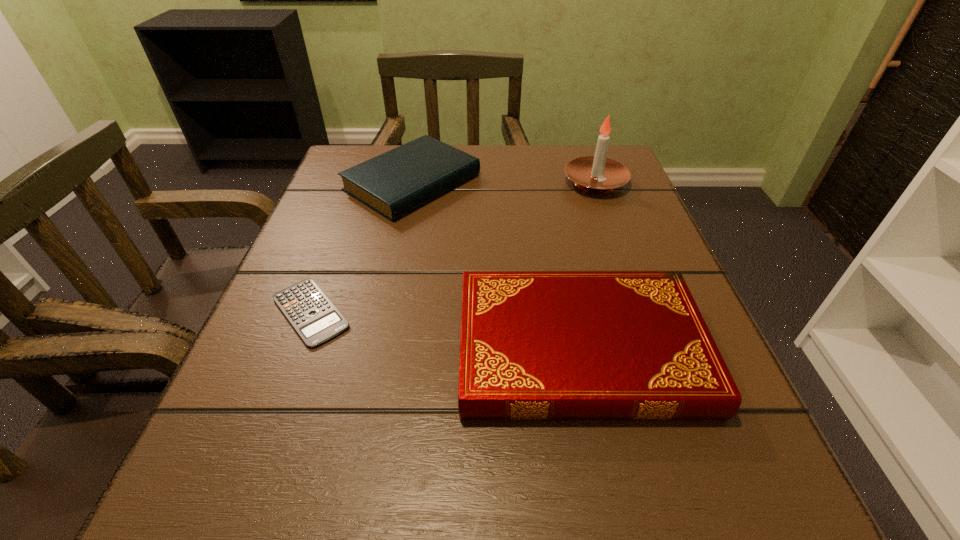
Where is `free space at the left edge of the desktop`? This screenshot has width=960, height=540. free space at the left edge of the desktop is located at coordinates (350, 204).

The height and width of the screenshot is (540, 960). What are the coordinates of `free space at the near left corner of the desktop` in the screenshot? It's located at (204, 513).

In order to click on vacant area that lies between the nearer book and the candle in this screenshot , I will do click(x=588, y=266).

I want to click on unoccupied position between the nearer book and the farther book, so click(x=496, y=266).

At what (x,y) coordinates should I click in order to perform the action: click on free point between the farther book and the candle. Please return your answer as a coordinate pair (x, y). The width and height of the screenshot is (960, 540). Looking at the image, I should click on (504, 183).

This screenshot has width=960, height=540. Identify the location of free spot between the tallest object and the farther book. (504, 183).

This screenshot has height=540, width=960. I want to click on vacant space that is in between the farther book and the tallest object, so click(504, 183).

I want to click on free point between the tallest object and the farther book, so click(504, 183).

The width and height of the screenshot is (960, 540). Find the location of `free area in between the tallest object and the nearer book`. free area in between the tallest object and the nearer book is located at coordinates (588, 266).

Where is `vacant point located between the nearer book and the calculator`? vacant point located between the nearer book and the calculator is located at coordinates (445, 331).